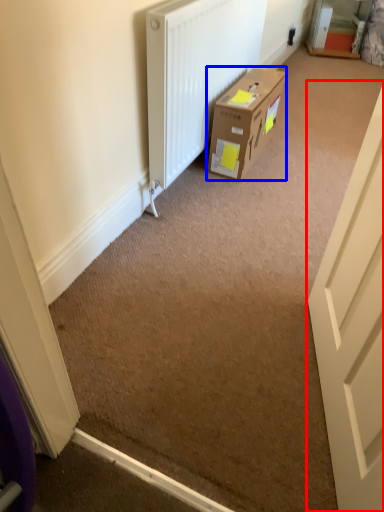
Question: Which of the following is the farthest to the observer, door (highlighted by a red box) or box (highlighted by a blue box)?

Choices:
 (A) door
 (B) box

Answer: (B)